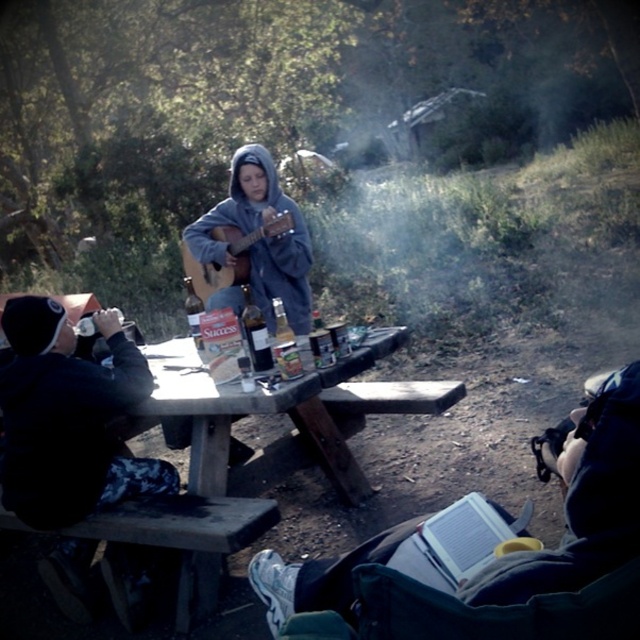
Question: Considering the real-world distances, which object is closest to the translucent glass bottle at center?

Choices:
 (A) gray fleece hoodie at center
 (B) acoustic wood guitar at center
 (C) clear glass bottle at center

Answer: (C)

Question: Does gray fleece hoodie at center have a smaller size compared to translucent glass bottle at center?

Choices:
 (A) yes
 (B) no

Answer: (B)

Question: Is dark gray hoodie at center bigger than clear glass bottle at center?

Choices:
 (A) no
 (B) yes

Answer: (B)

Question: Based on their relative distances, which object is farther from the clear glass bottle at center?

Choices:
 (A) gray fleece hoodie at center
 (B) translucent glass bottle at center

Answer: (A)

Question: Which object is farther from the camera taking this photo?

Choices:
 (A) acoustic wood guitar at center
 (B) translucent glass bottle at center
 (C) dark gray hoodie at center

Answer: (A)

Question: Can you confirm if dark gray hoodie at center is thinner than translucent glass bottle at center?

Choices:
 (A) no
 (B) yes

Answer: (A)